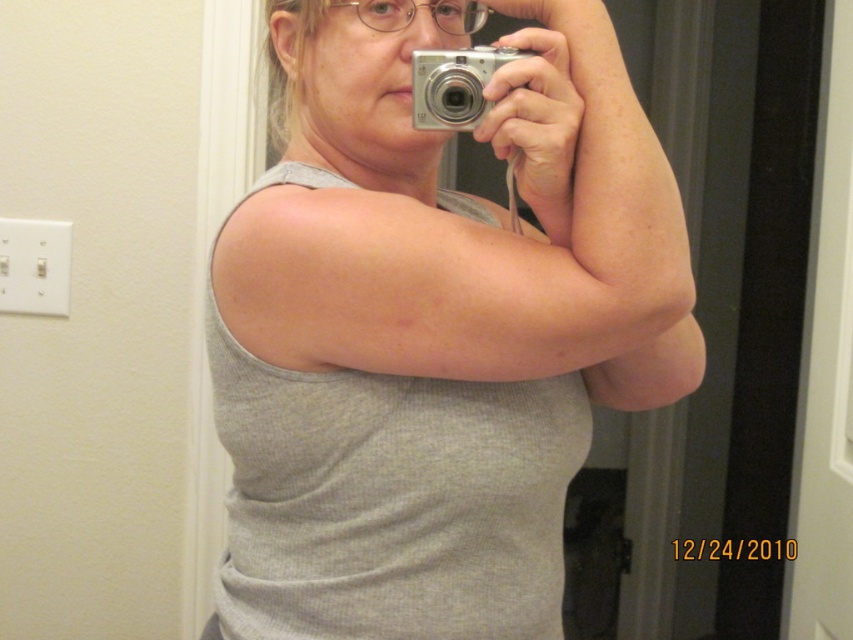
Question: Among these objects, which one is nearest to the camera?

Choices:
 (A) silver metallic camera at center
 (B) gray ribbed tank top at center

Answer: (B)

Question: Is gray ribbed tank top at center positioned in front of silver metallic camera at center?

Choices:
 (A) no
 (B) yes

Answer: (B)

Question: Can you confirm if gray ribbed tank top at center is wider than silver metallic camera at center?

Choices:
 (A) yes
 (B) no

Answer: (A)

Question: Is gray ribbed tank top at center thinner than silver metallic camera at center?

Choices:
 (A) no
 (B) yes

Answer: (A)

Question: Among these points, which one is farthest from the camera?

Choices:
 (A) (471, 92)
 (B) (407, 204)

Answer: (B)